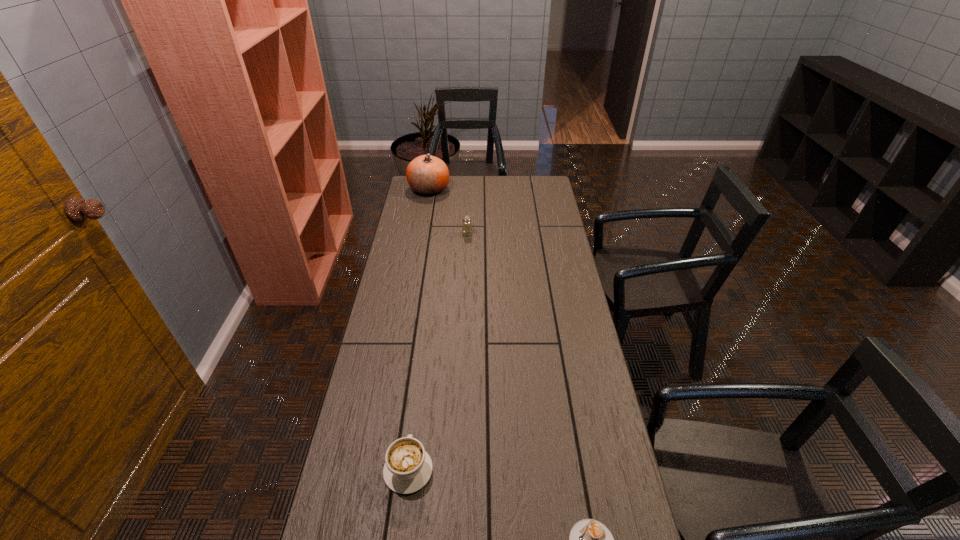
This screenshot has height=540, width=960. I want to click on vacant area between the tallest object and the farther cappuccino, so click(419, 329).

Image resolution: width=960 pixels, height=540 pixels. I want to click on empty space between the third farthest object and the third nearest object, so click(x=438, y=352).

At what (x,y) coordinates should I click in order to perform the action: click on empty space between the pumpkin and the saltshaker. Please return your answer as a coordinate pair (x, y). This screenshot has height=540, width=960. Looking at the image, I should click on (448, 211).

What are the coordinates of `free space that is in between the second object from right to left and the farthest object` in the screenshot? It's located at (448, 211).

Identify which object is located as the nearest to the tallest object. Please provide its 2D coordinates. Your answer should be formatted as a tuple, i.e. [(x, y)], where the tuple contains the x and y coordinates of a point satisfying the conditions above.

[(466, 224)]

Locate an element on the screen. the closest object to the second nearest object is located at coordinates (589, 539).

What are the coordinates of `vacant space that satisfies the following two spatial constraints: 1. to the right of the second nearest object's handle; 2. on the right side of the saltshaker` in the screenshot? It's located at (438, 234).

Where is `blank space that satisfies the following two spatial constraints: 1. on the front side of the pumpkin; 2. on the right side of the third nearest object`? blank space that satisfies the following two spatial constraints: 1. on the front side of the pumpkin; 2. on the right side of the third nearest object is located at coordinates (421, 234).

Where is `vacant space that satisfies the following two spatial constraints: 1. to the right of the farther cappuccino's handle; 2. on the left side of the saltshaker`? The height and width of the screenshot is (540, 960). vacant space that satisfies the following two spatial constraints: 1. to the right of the farther cappuccino's handle; 2. on the left side of the saltshaker is located at coordinates (438, 234).